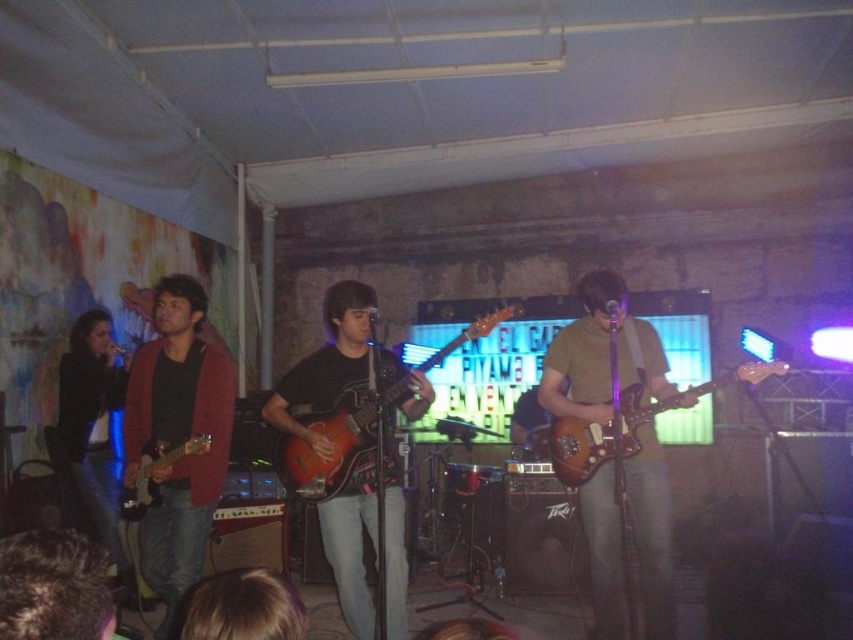
Is brushed metal guitar at left taller than matte black guitar at center?

Correct, brushed metal guitar at left is much taller as matte black guitar at center.

Which is above, brushed metal guitar at left or matte black guitar at center?

Positioned higher is brushed metal guitar at left.

Does point (172, 531) come farther from viewer compared to point (323, 388)?

No, it is not.

Find the location of `brushed metal guitar at left`. brushed metal guitar at left is located at coordinates (178, 435).

Between matte black guitar at center and brown wooden guitar at center, which one has less height?

Standing shorter between the two is brown wooden guitar at center.

Does matte black guitar at center have a lesser width compared to brown wooden guitar at center?

Yes.

Is point (403, 401) more distant than point (627, 433)?

Yes, it is.

Locate an element on the screen. This screenshot has width=853, height=640. matte black guitar at center is located at coordinates (326, 365).

Which of these two, brushed metal guitar at left or blonde hair at lower center, stands shorter?

With less height is blonde hair at lower center.

Is point (184, 483) farther from viewer compared to point (219, 589)?

Yes, point (184, 483) is behind point (219, 589).

This screenshot has width=853, height=640. Find the location of `brushed metal guitar at left`. brushed metal guitar at left is located at coordinates (178, 435).